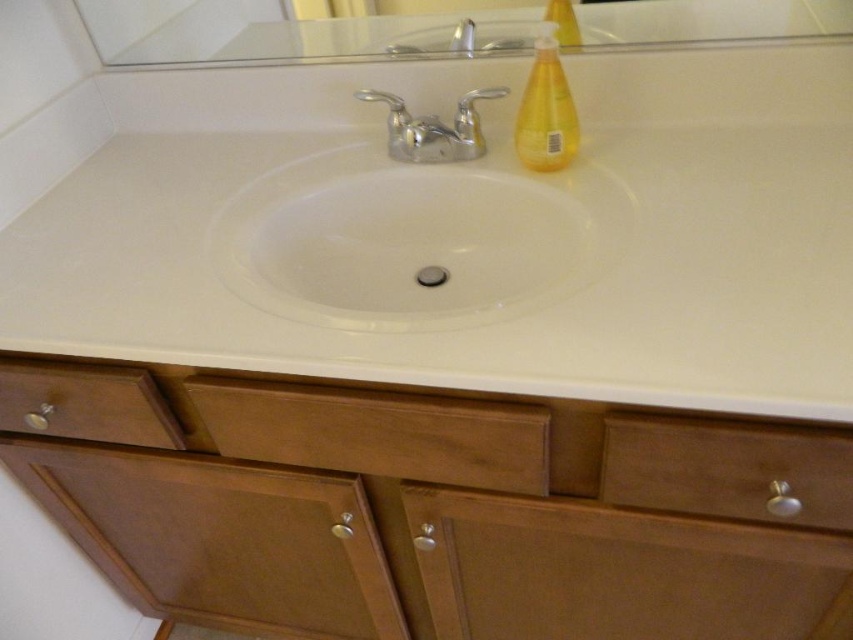
You are organizing the bathroom vanity and need to place both the wooden drawer at center and the matte gray soap at center on the white countertop. Given their sizes, which object should you place first to ensure they both fit properly?

The wooden drawer at center has a larger size compared to matte gray soap at center, so you should place the wooden drawer at center first to ensure there is enough space for both items on the white countertop.

You are standing in front of the bathroom vanity and want to know which of the two points, point (x=544, y=68) or point (x=468, y=44), is closer to you. Based on the description, which point is closer?

Point (x=544, y=68) is closer to the camera than point (x=468, y=44), so it is closer to you.

You are trying to find a place to store a small box. You have two options in the bathroom vanity area, the wooden drawer at lower left and the yellow translucent bottle at upper right. Which one is shorter and can fit the box vertically?

The wooden drawer at lower left is not as tall as the yellow translucent bottle at upper right, so the wooden drawer at lower left is shorter and can fit the box vertically.